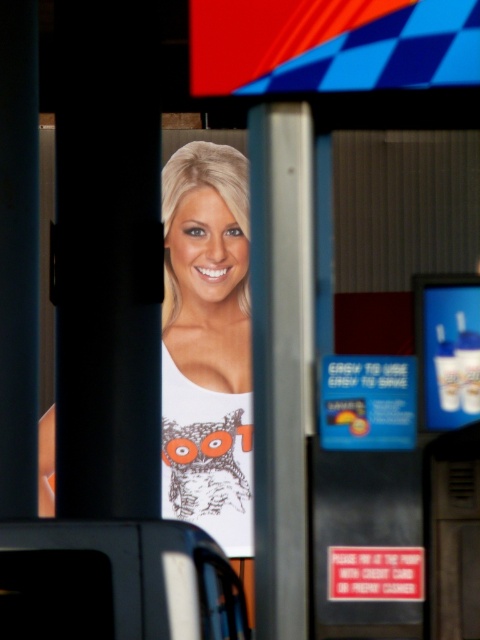
Is metallic silver pillar at center to the left of blue plastic credit card at center from the viewer's perspective?

Indeed, metallic silver pillar at center is positioned on the left side of blue plastic credit card at center.

Which of these two, metallic silver pillar at center or blue plastic credit card at center, stands taller?

With more height is metallic silver pillar at center.

Does point (288, 605) come behind point (359, 436)?

No, it is not.

Locate an element on the screen. This screenshot has height=640, width=480. metallic silver pillar at center is located at coordinates (280, 358).

Is white matte tank top at center positioned at the back of metallic silver pillar at center?

Yes, white matte tank top at center is behind metallic silver pillar at center.

Measure the distance from white matte tank top at center to metallic silver pillar at center.

A distance of 41.16 feet exists between white matte tank top at center and metallic silver pillar at center.

Is point (175, 198) less distant than point (290, 461)?

No.

The height and width of the screenshot is (640, 480). I want to click on white matte tank top at center, so click(206, 342).

Which is above, white matte tank top at center or blue plastic credit card at center?

Positioned higher is white matte tank top at center.

Describe the element at coordinates (206, 342) in the screenshot. The height and width of the screenshot is (640, 480). I see `white matte tank top at center` at that location.

Identify the location of white matte tank top at center. (206, 342).